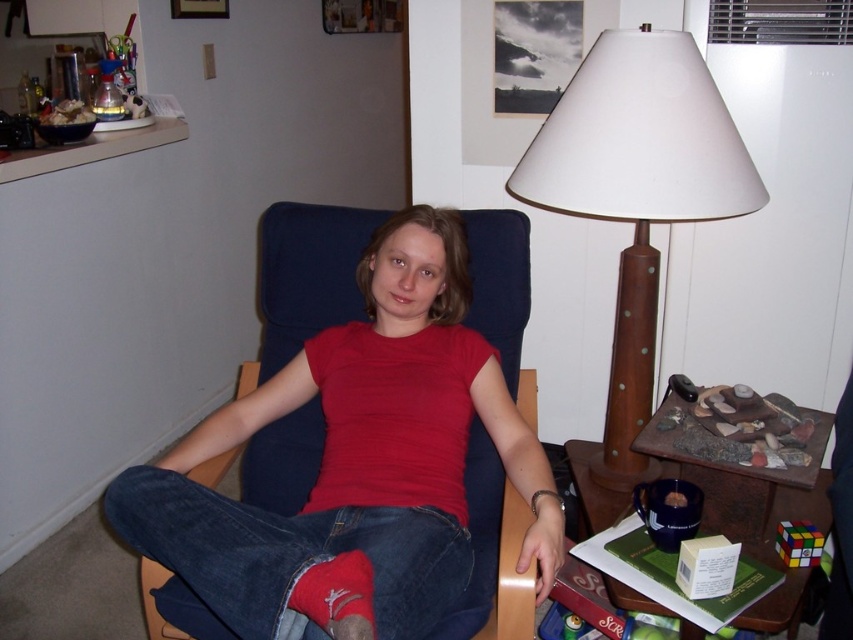
Question: Which object is closer to the camera taking this photo?

Choices:
 (A) brown polished wood lamp at upper right
 (B) denim at center

Answer: (B)

Question: From the image, what is the correct spatial relationship of matte red shirt at center in relation to red cotton sock at lower left?

Choices:
 (A) above
 (B) below

Answer: (A)

Question: Among these objects, which one is nearest to the camera?

Choices:
 (A) red cotton sock at lower left
 (B) denim at center

Answer: (A)

Question: Which point is farther to the camera?

Choices:
 (A) (724, 144)
 (B) (325, 628)
 (C) (196, 582)

Answer: (A)

Question: Can you confirm if matte red shirt at center is wider than red cotton sock at lower left?

Choices:
 (A) no
 (B) yes

Answer: (B)

Question: In this image, where is brown polished wood lamp at upper right located relative to red cotton sock at lower left?

Choices:
 (A) below
 (B) above

Answer: (B)